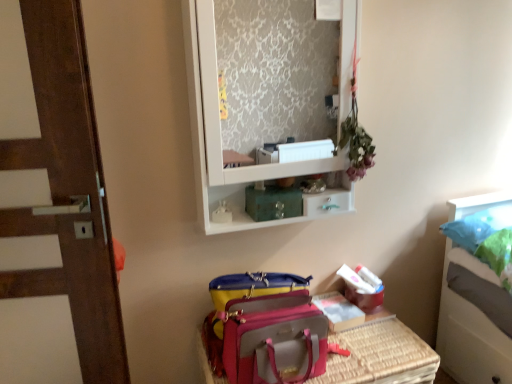
Measure the distance between point (307,216) and camera.

Point (307,216) is 1.59 meters from camera.

Where is `white glossy medicine cabinet at upper center`? The image size is (512, 384). white glossy medicine cabinet at upper center is located at coordinates (267, 99).

What do you see at coordinates (267, 99) in the screenshot?
I see `white glossy medicine cabinet at upper center` at bounding box center [267, 99].

Measure the distance between point (346, 359) and camera.

Point (346, 359) and camera are 5.12 feet apart from each other.

Find the location of a particular element. This screenshot has height=384, width=512. metallic teal drawer at upper center is located at coordinates (328, 202).

Considering their positions, is metallic teal drawer at upper center located in front of or behind pink fabric suitcase at lower center?

Visually, metallic teal drawer at upper center is located behind pink fabric suitcase at lower center.

Which of these two, metallic teal drawer at upper center or pink fabric suitcase at lower center, is thinner?

metallic teal drawer at upper center.

Is metallic teal drawer at upper center inside or outside of pink fabric suitcase at lower center?

metallic teal drawer at upper center is outside pink fabric suitcase at lower center.

From a real-world perspective, is metallic teal drawer at upper center positioned over pink fabric suitcase at lower center based on gravity?

Yes, from a real-world perspective, metallic teal drawer at upper center is on top of pink fabric suitcase at lower center.

Who is more distant, white glossy medicine cabinet at upper center or metallic teal drawer at upper center?

metallic teal drawer at upper center is further away from the camera.

Considering the sizes of objects white glossy medicine cabinet at upper center and metallic teal drawer at upper center in the image provided, who is thinner, white glossy medicine cabinet at upper center or metallic teal drawer at upper center?

metallic teal drawer at upper center.

From a real-world perspective, who is located higher, white glossy medicine cabinet at upper center or metallic teal drawer at upper center?

white glossy medicine cabinet at upper center, from a real-world perspective.

Considering the positions of points (267, 7) and (326, 196), is point (267, 7) closer to camera compared to point (326, 196)?

No, it is not.

Which object is closer to the camera taking this photo, pink fabric suitcase at lower center or metallic teal drawer at upper center?

pink fabric suitcase at lower center is closer to the camera.

Is point (359, 379) behind point (312, 196)?

No, it is not.

Could you tell me if pink fabric suitcase at lower center is turned towards metallic teal drawer at upper center?

No, pink fabric suitcase at lower center is not facing towards metallic teal drawer at upper center.

This screenshot has width=512, height=384. Find the location of `drawer that is behind the white glossy medicine cabinet at upper center`. drawer that is behind the white glossy medicine cabinet at upper center is located at coordinates tap(328, 202).

Is point (329, 206) in front of point (316, 139)?

Yes, it is in front of point (316, 139).

From a real-world perspective, is metallic teal drawer at upper center positioned above or below white glossy medicine cabinet at upper center?

metallic teal drawer at upper center is situated lower than white glossy medicine cabinet at upper center in the real world.

Is metallic teal drawer at upper center positioned with its back to white glossy medicine cabinet at upper center?

Yes, metallic teal drawer at upper center is facing away from white glossy medicine cabinet at upper center.

Between point (339, 367) and point (344, 63), which one is positioned behind?

Positioned behind is point (344, 63).

From a real-world perspective, is pink fabric suitcase at lower center physically located above or below white glossy medicine cabinet at upper center?

From a real-world perspective, pink fabric suitcase at lower center is physically below white glossy medicine cabinet at upper center.

Does pink fabric suitcase at lower center have a greater height compared to white glossy medicine cabinet at upper center?

Incorrect, the height of pink fabric suitcase at lower center is not larger of that of white glossy medicine cabinet at upper center.

Is pink fabric suitcase at lower center bigger or smaller than white glossy medicine cabinet at upper center?

Clearly, pink fabric suitcase at lower center is larger in size than white glossy medicine cabinet at upper center.

Between white glossy medicine cabinet at upper center and pink fabric suitcase at lower center, which one has more height?

Standing taller between the two is white glossy medicine cabinet at upper center.

Is white glossy medicine cabinet at upper center aimed at pink fabric suitcase at lower center?

No, white glossy medicine cabinet at upper center does not turn towards pink fabric suitcase at lower center.

Locate an element on the screen. This screenshot has height=384, width=512. furniture located in front of the metallic teal drawer at upper center is located at coordinates (381, 354).

The image size is (512, 384). What are the coordinates of `drawer lying on the right of white glossy medicine cabinet at upper center` in the screenshot? It's located at (328, 202).

When comparing their distances from white glossy medicine cabinet at upper center, does pink fabric suitcase at lower center or metallic teal drawer at upper center seem further?

metallic teal drawer at upper center lies further to white glossy medicine cabinet at upper center than the other object.

Looking at the image, which one is located closer to white glossy medicine cabinet at upper center, metallic teal drawer at upper center or pink fabric suitcase at lower center?

pink fabric suitcase at lower center.

Looking at the image, which one is located closer to metallic teal drawer at upper center, pink fabric suitcase at lower center or white glossy medicine cabinet at upper center?

Among the two, pink fabric suitcase at lower center is located nearer to metallic teal drawer at upper center.

Which object lies nearer to the anchor point metallic teal drawer at upper center, white glossy medicine cabinet at upper center or pink fabric suitcase at lower center?

pink fabric suitcase at lower center.

Consider the image. Looking at the image, which one is located closer to pink fabric suitcase at lower center, metallic teal drawer at upper center or white glossy medicine cabinet at upper center?

metallic teal drawer at upper center is positioned closer to the anchor pink fabric suitcase at lower center.

Based on their spatial positions, is white glossy medicine cabinet at upper center or metallic teal drawer at upper center further from pink fabric suitcase at lower center?

Based on the image, white glossy medicine cabinet at upper center appears to be further to pink fabric suitcase at lower center.

Find the location of `drawer between white glossy medicine cabinet at upper center and pink fabric suitcase at lower center in the up-down direction`. drawer between white glossy medicine cabinet at upper center and pink fabric suitcase at lower center in the up-down direction is located at coordinates [328, 202].